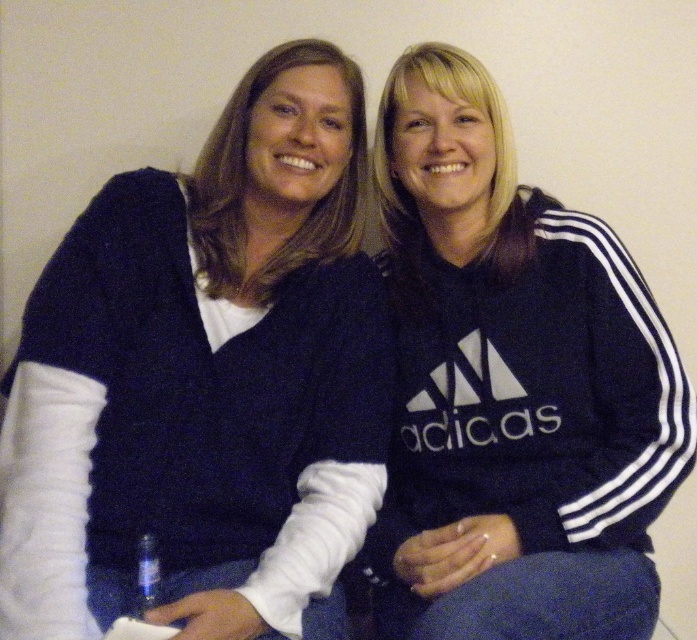
Does knitted dark blue sweater at left have a greater width compared to navy blue hoodie at center?

Indeed, knitted dark blue sweater at left has a greater width compared to navy blue hoodie at center.

Based on the photo, can you confirm if knitted dark blue sweater at left is taller than navy blue hoodie at center?

In fact, knitted dark blue sweater at left may be shorter than navy blue hoodie at center.

Describe the element at coordinates (206, 380) in the screenshot. This screenshot has height=640, width=697. I see `knitted dark blue sweater at left` at that location.

This screenshot has width=697, height=640. I want to click on knitted dark blue sweater at left, so click(206, 380).